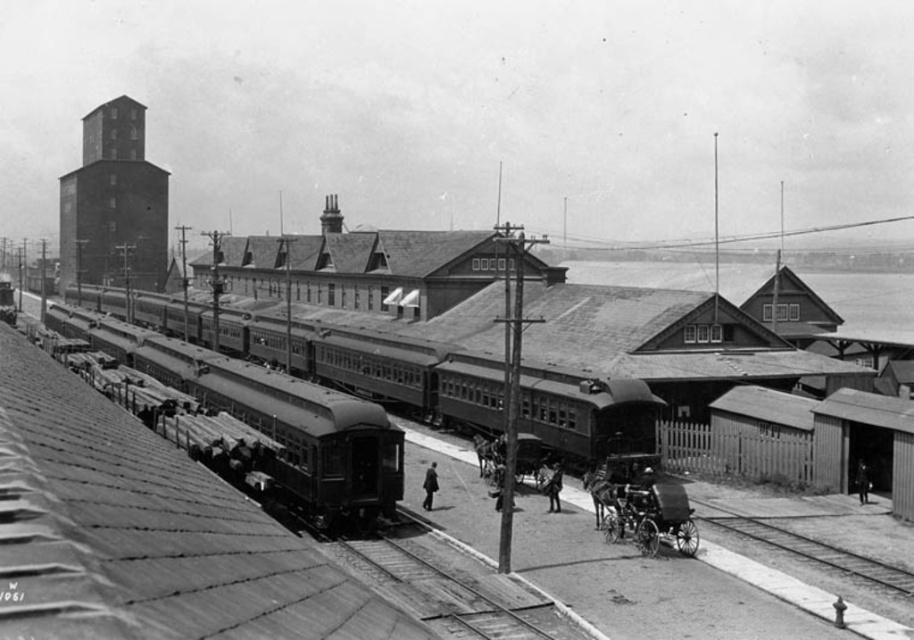
You are a traveler standing at the train station and you see the smooth wood track at lower right and the smooth leather coat at center. Which object is taller?

The smooth leather coat at center is taller than the smooth wood track at lower right.

You are a photographer standing at the train station and want to capture a closeup shot of the smooth wood track at lower right. Given that your camera can focus on objects up to 20 meters away, will you be able to take the photo without moving closer?

The smooth wood track at lower right is 23.38 meters away from camera, which is beyond the camera focus limit of 20 meters. Therefore, you cannot take the photo without moving closer.